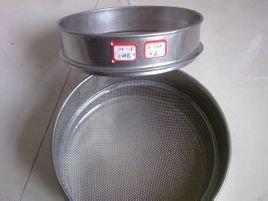
The image size is (268, 201). I want to click on white surface, so click(x=240, y=46).